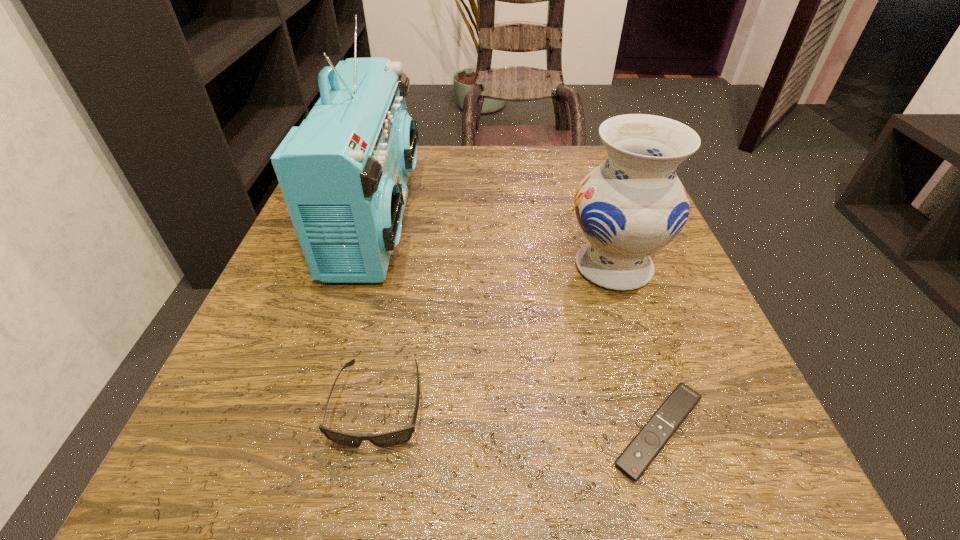
You are a GUI agent. You are given a task and a screenshot of the screen. Output one action in this format:
    pyautogui.click(x=<x>, y=<y>)
    Task: Click on the radio receiver
    The height and width of the screenshot is (540, 960).
    Given the screenshot: What is the action you would take?
    pyautogui.click(x=343, y=172)

Where is `vase`? Image resolution: width=960 pixels, height=540 pixels. vase is located at coordinates point(632,205).

Locate an element on the screen. The image size is (960, 540). sunglasses is located at coordinates (397, 437).

I want to click on remote control, so click(643, 449).

At what (x,y) coordinates should I click in order to perform the action: click on vacant region located 0.340m on the front-facing side of the radio receiver. Please return your answer as a coordinate pair (x, y). Looking at the image, I should click on (584, 217).

The image size is (960, 540). In order to click on free space located on the front of the third shortest object in this screenshot , I will do (684, 478).

Locate an element on the screen. blank space located on the front-facing side of the third tallest object is located at coordinates (361, 495).

Locate an element on the screen. The image size is (960, 540). vacant space located on the left of the shortest object is located at coordinates (558, 431).

You are a GUI agent. You are given a task and a screenshot of the screen. Output one action in this format:
    pyautogui.click(x=<x>, y=<y>)
    Task: Click on the object located at the far edge
    The width and height of the screenshot is (960, 540).
    Given the screenshot: What is the action you would take?
    pyautogui.click(x=343, y=172)

The height and width of the screenshot is (540, 960). I want to click on sunglasses located in the near edge section of the desktop, so click(x=397, y=437).